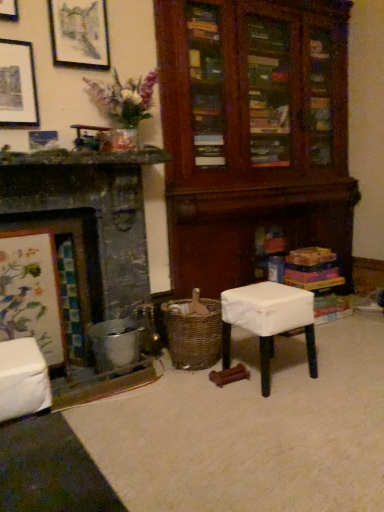
Question: Is metallic silver picture frame at upper left, which is the third picture frame in top-to-bottom order, not inside matte black picture frame at upper left, the 2th picture frame when ordered from top to bottom?

Choices:
 (A) yes
 (B) no

Answer: (A)

Question: Are metallic silver picture frame at upper left, which is the third picture frame in top-to-bottom order, and matte black picture frame at upper left, the 2th picture frame when ordered from top to bottom, beside each other?

Choices:
 (A) no
 (B) yes

Answer: (A)

Question: Considering the relative sizes of metallic silver picture frame at upper left, which is the third picture frame in top-to-bottom order, and matte black picture frame at upper left, marked as the 2th picture frame in a bottom-to-top arrangement, in the image provided, is metallic silver picture frame at upper left, which is the third picture frame in top-to-bottom order, bigger than matte black picture frame at upper left, marked as the 2th picture frame in a bottom-to-top arrangement,?

Choices:
 (A) no
 (B) yes

Answer: (A)

Question: Can you confirm if metallic silver picture frame at upper left, which is the third picture frame in top-to-bottom order, is taller than matte black picture frame at upper left, the 2th picture frame when ordered from top to bottom?

Choices:
 (A) no
 (B) yes

Answer: (A)

Question: Considering the relative sizes of metallic silver picture frame at upper left, which is the first picture frame from bottom to top, and matte black picture frame at upper left, the 2th picture frame when ordered from top to bottom, in the image provided, is metallic silver picture frame at upper left, which is the first picture frame from bottom to top, shorter than matte black picture frame at upper left, the 2th picture frame when ordered from top to bottom,?

Choices:
 (A) no
 (B) yes

Answer: (B)

Question: In terms of size, does woven brown basket at lower center appear bigger or smaller than matte black picture frame at upper left, which appears as the 3th picture frame when ordered from the bottom?

Choices:
 (A) small
 (B) big

Answer: (B)

Question: From the image's perspective, is woven brown basket at lower center located above or below matte black picture frame at upper left, which appears as the 3th picture frame when ordered from the bottom?

Choices:
 (A) above
 (B) below

Answer: (B)

Question: Is woven brown basket at lower center in front of or behind matte black picture frame at upper left, the 1th picture frame in the top-to-bottom sequence, in the image?

Choices:
 (A) front
 (B) behind

Answer: (A)

Question: From a real-world perspective, is woven brown basket at lower center above or below matte black picture frame at upper left, which appears as the 3th picture frame when ordered from the bottom?

Choices:
 (A) above
 (B) below

Answer: (B)

Question: Is white fabric-covered stool at center to the left or to the right of woven brown basket at lower center in the image?

Choices:
 (A) right
 (B) left

Answer: (A)

Question: Is point 311,368 closer or farther from the camera than point 203,303?

Choices:
 (A) farther
 (B) closer

Answer: (B)

Question: Relative to woven brown basket at lower center, is white fabric-covered stool at center in front or behind?

Choices:
 (A) front
 (B) behind

Answer: (A)

Question: Considering the positions of white fabric-covered stool at center and woven brown basket at lower center in the image, is white fabric-covered stool at center wider or thinner than woven brown basket at lower center?

Choices:
 (A) thin
 (B) wide

Answer: (A)

Question: From a real-world perspective, relative to metallic silver picture frame at upper left, which is the third picture frame in top-to-bottom order, is white fabric-covered stool at center vertically above or below?

Choices:
 (A) above
 (B) below

Answer: (B)

Question: Considering the positions of white fabric-covered stool at center and metallic silver picture frame at upper left, which is the first picture frame from bottom to top, in the image, is white fabric-covered stool at center taller or shorter than metallic silver picture frame at upper left, which is the first picture frame from bottom to top,?

Choices:
 (A) tall
 (B) short

Answer: (A)